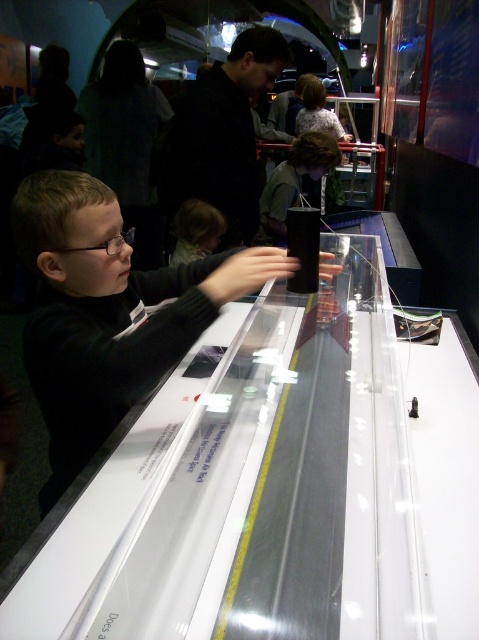
Where is `matte black shirt at center`? matte black shirt at center is located at coordinates (109, 312).

Does matte black shirt at center lie in front of smooth brown hair at center?

Yes, it is in front of smooth brown hair at center.

Who is more distant from viewer, (x=47, y=257) or (x=226, y=221)?

The point (x=226, y=221) is behind.

The image size is (479, 640). I want to click on matte black shirt at center, so click(109, 312).